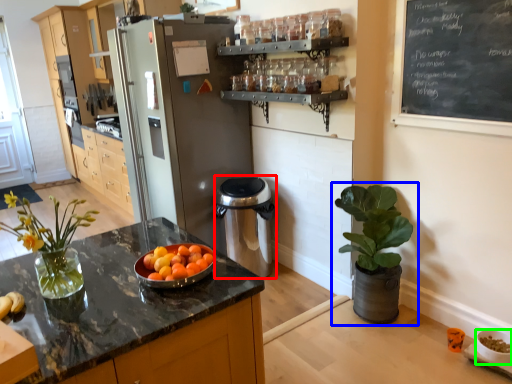
Question: Considering the real-world distances, which object is closest to appliance (highlighted by a red box)? houseplant (highlighted by a blue box) or glass bowl (highlighted by a green box).

Choices:
 (A) houseplant
 (B) glass bowl

Answer: (A)